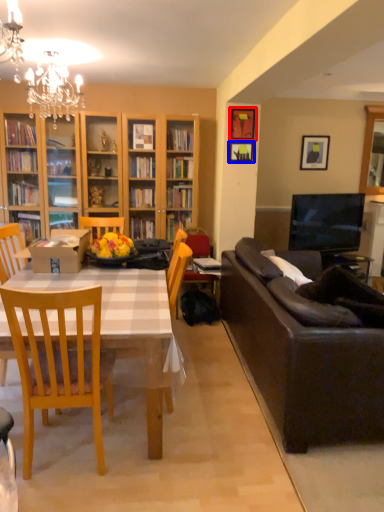
Question: Which object is further to the camera taking this photo, picture frame (highlighted by a red box) or picture frame (highlighted by a blue box)?

Choices:
 (A) picture frame
 (B) picture frame

Answer: (B)